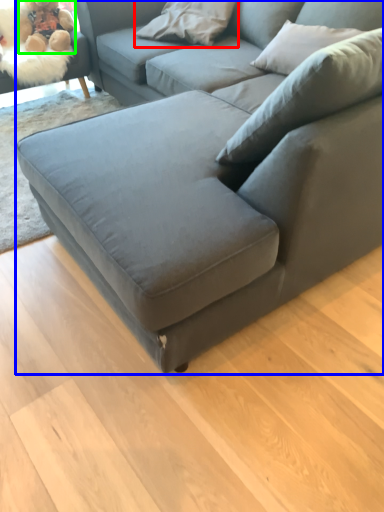
Question: Which object is the farthest from pillow (highlighted by a red box)? Choose among these: studio couch (highlighted by a blue box) or toy (highlighted by a green box).

Choices:
 (A) studio couch
 (B) toy

Answer: (A)